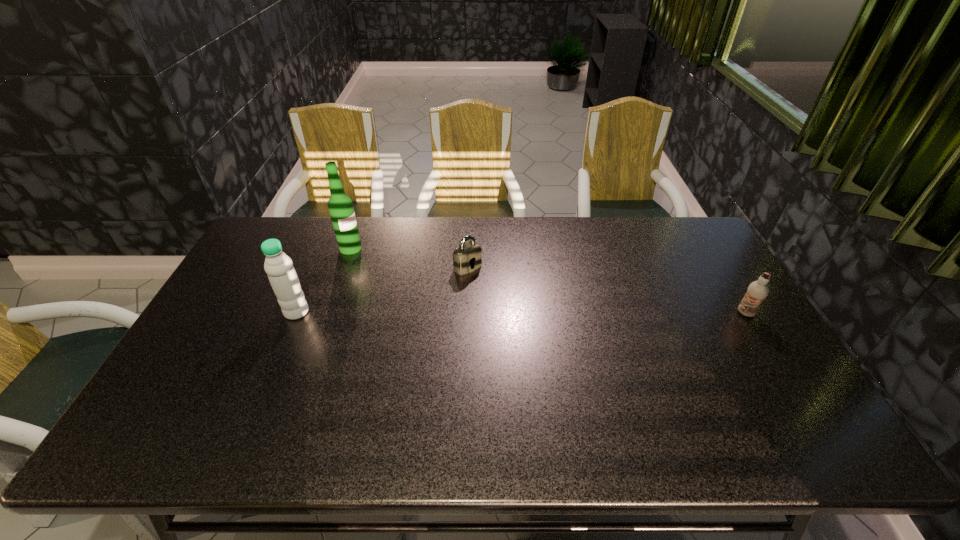
Identify the location of free space at the left edge of the desktop. (242, 295).

Where is `free location at the right edge`? free location at the right edge is located at coordinates (764, 377).

The height and width of the screenshot is (540, 960). In order to click on blank space at the far right corner in this screenshot , I will do (x=662, y=245).

The width and height of the screenshot is (960, 540). In order to click on vacant area between the water bottle and the chocolate milk in this screenshot , I will do `click(521, 313)`.

Where is `free space between the leftmost object and the shortest object`? Image resolution: width=960 pixels, height=540 pixels. free space between the leftmost object and the shortest object is located at coordinates [382, 289].

You are a GUI agent. You are given a task and a screenshot of the screen. Output one action in this format:
    pyautogui.click(x=<x>, y=<y>)
    Task: Click on the vacant space in between the second object from right to left and the farthest object
    The image size is (960, 540).
    Given the screenshot: What is the action you would take?
    pyautogui.click(x=409, y=258)

At what (x,y) coordinates should I click in order to perform the action: click on vacant space that's between the third object from right to left and the chocolate milk. Please return your answer as a coordinate pair (x, y). Image resolution: width=960 pixels, height=540 pixels. Looking at the image, I should click on pyautogui.click(x=548, y=281).

This screenshot has width=960, height=540. I want to click on empty location between the second tallest object and the shortest object, so click(x=382, y=289).

The image size is (960, 540). Identify the location of free space between the chocolate milk and the third object from right to left. (548, 281).

Where is `vacant area between the chocolate milk and the third object from left to right`? The width and height of the screenshot is (960, 540). vacant area between the chocolate milk and the third object from left to right is located at coordinates (607, 291).